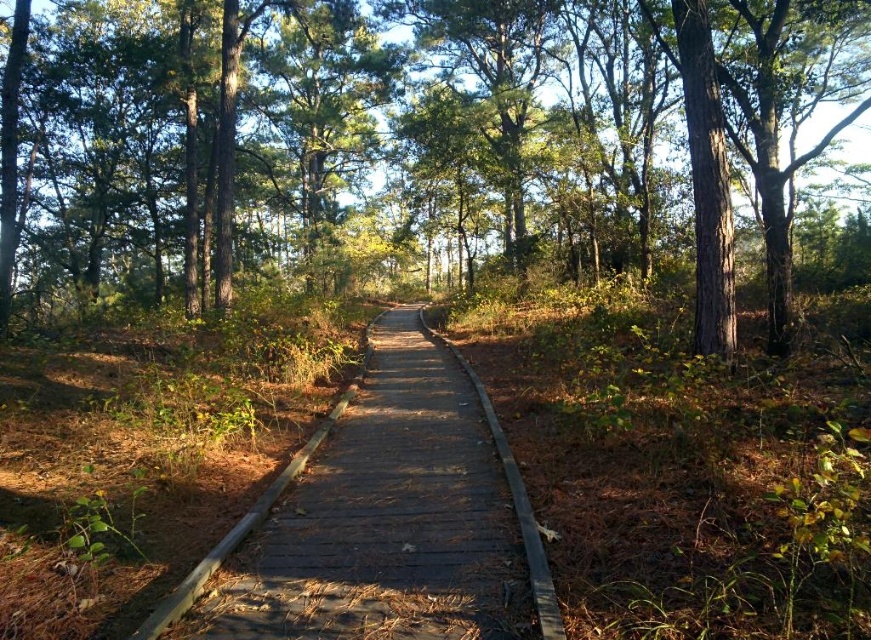
Who is higher up, green matte tree at center or wooden boardwalk at center?

green matte tree at center is above.

Does green matte tree at center have a lesser width compared to wooden boardwalk at center?

No.

The width and height of the screenshot is (871, 640). I want to click on green matte tree at center, so click(x=410, y=140).